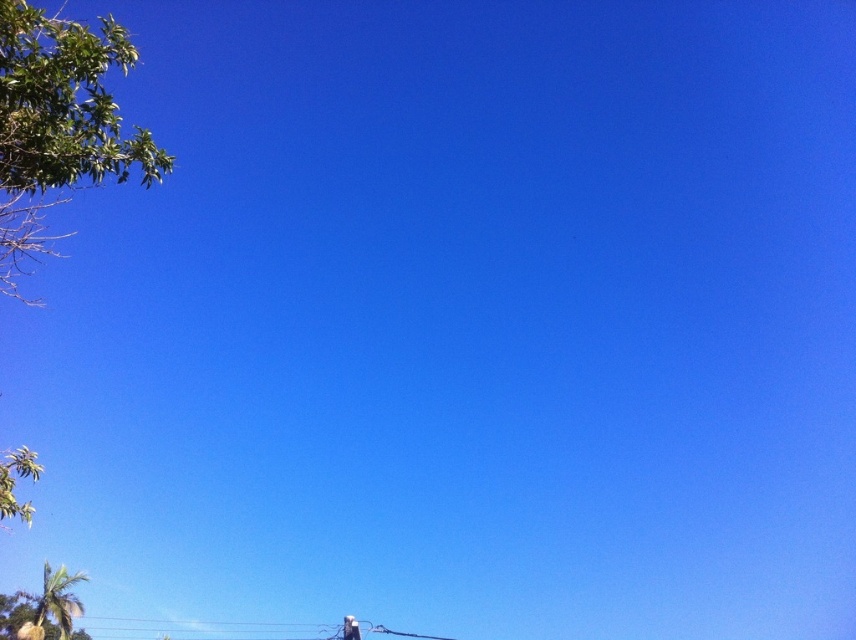
You are a bird flying in the clear blue sky. You see a point at coordinates (58, 122). What object is located at that point?

The point at coordinates (58, 122) corresponds to the green leafy tree at upper left.